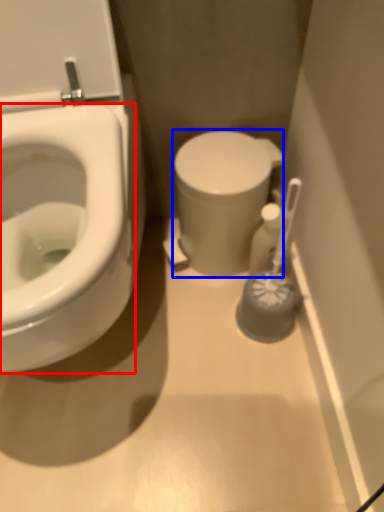
Question: Among these objects, which one is nearest to the camera, bidet (highlighted by a red box) or porcelain (highlighted by a blue box)?

Choices:
 (A) bidet
 (B) porcelain

Answer: (A)